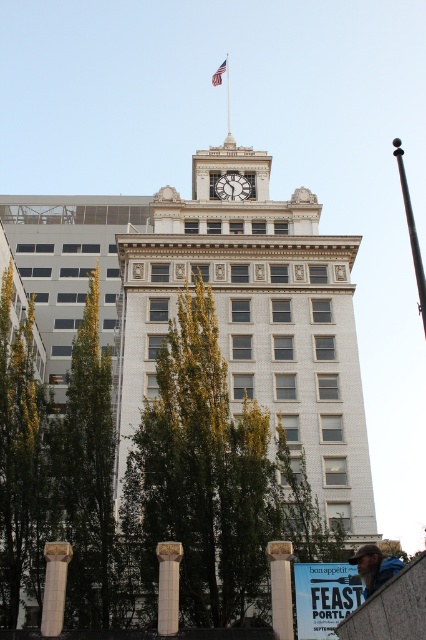
What do you see at coordinates (227, 93) in the screenshot? I see `metallic flag pole at upper center` at bounding box center [227, 93].

Is point (227, 81) positioned behind point (218, 76)?

That is False.

Locate an element on the screen. The image size is (426, 640). metallic flag pole at upper center is located at coordinates (227, 93).

Does white marble column at lower left come in front of metallic flag pole at upper center?

Yes, white marble column at lower left is in front of metallic flag pole at upper center.

You are a GUI agent. You are given a task and a screenshot of the screen. Output one action in this format:
    pyautogui.click(x=<x>, y=<y>)
    Task: Click on the white marble column at lower left
    Image resolution: width=426 pixels, height=640 pixels.
    Given the screenshot: What is the action you would take?
    pyautogui.click(x=54, y=586)

Does white marble column at lower left appear on the right side of white stone column at lower center?

In fact, white marble column at lower left is to the left of white stone column at lower center.

Where is `white marble column at lower left`? white marble column at lower left is located at coordinates (54, 586).

Locate an element on the screen. white marble column at lower left is located at coordinates (54, 586).